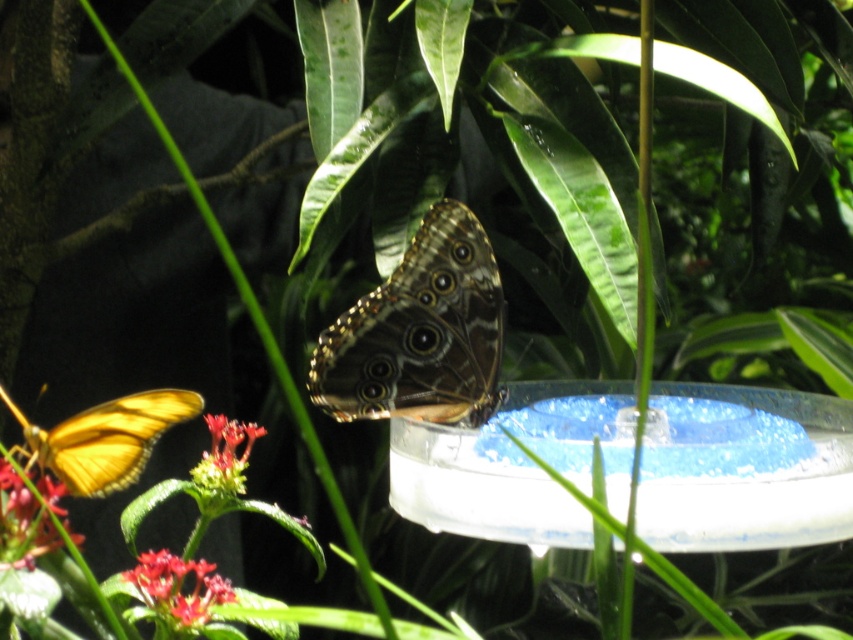
You are a botanist studying the positioning of flowers in the garden. The coordinates are given in a normalized system where the bottom left corner is the origin. Where is the smooth red petals at lower left located in terms of coordinates?

The smooth red petals at lower left are located at coordinates point [178,589].

You are a gardener trying to identify the largest object between the translucent yellow butterfly at lower left and the smooth red flower at lower left. Which one is bigger?

The translucent yellow butterfly at lower left is larger than the smooth red flower at lower left according to the description.

You are a gardener observing the scene. You notice a translucent yellow butterfly at lower left and a smooth red flower at lower left. Which one is positioned higher in the image?

The translucent yellow butterfly at lower left is above the smooth red flower at lower left, so it is positioned higher in the image.